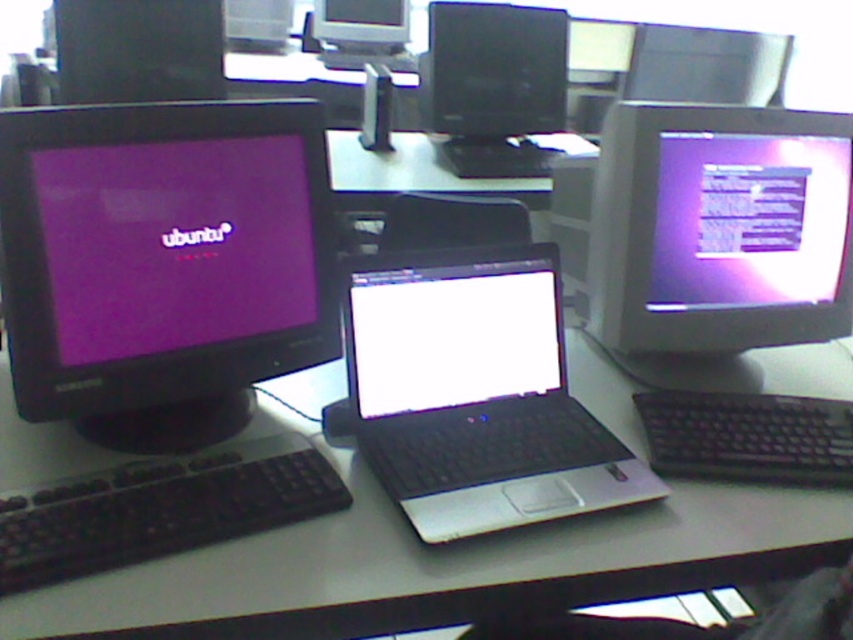
Is matte black monitor at left to the right of black plastic keyboard at lower left from the viewer's perspective?

In fact, matte black monitor at left is to the left of black plastic keyboard at lower left.

Is matte black monitor at left thinner than black plastic keyboard at lower left?

Incorrect, matte black monitor at left's width is not less than black plastic keyboard at lower left's.

Which is in front, point (107, 342) or point (103, 481)?

Point (103, 481) is in front.

Find the location of a particular element. The image size is (853, 640). matte black monitor at left is located at coordinates (163, 262).

Is black plastic keyboard at lower left further to camera compared to black plastic mouse at center?

That is False.

Who is positioned more to the right, black plastic keyboard at lower left or black plastic mouse at center?

black plastic mouse at center

Does point (334, 468) come farther from viewer compared to point (321, 417)?

No, (334, 468) is in front of (321, 417).

Identify the location of black plastic keyboard at lower left. (157, 513).

Can you confirm if black glossy monitor at upper center is shorter than matte black monitor at upper center?

Incorrect, black glossy monitor at upper center's height does not fall short of matte black monitor at upper center's.

Between black glossy monitor at upper center and matte black monitor at upper center, which one is positioned higher?

Positioned higher is matte black monitor at upper center.

I want to click on black glossy monitor at upper center, so click(492, 84).